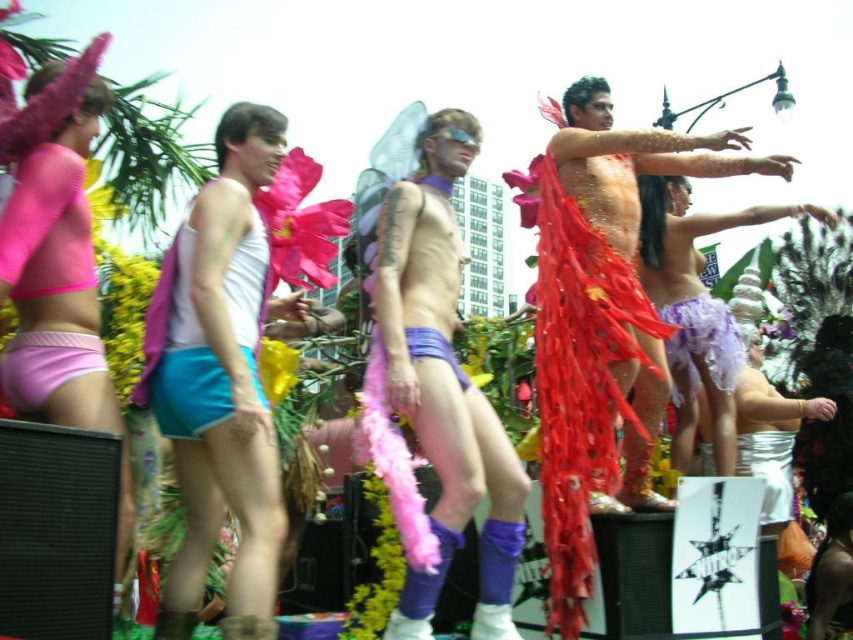
Is pink mesh top at left positioned in front of pink fabric underwear at lower left?

Yes, it is.

Who is shorter, pink mesh top at left or pink fabric underwear at lower left?

pink fabric underwear at lower left is shorter.

In order to click on pink mesh top at left in this screenshot , I will do `click(45, 227)`.

Which is above, pink matte shorts at left or pink fabric underwear at lower left?

pink matte shorts at left

Looking at this image, is pink matte shorts at left to the left of pink fabric underwear at lower left from the viewer's perspective?

Indeed, pink matte shorts at left is positioned on the left side of pink fabric underwear at lower left.

Describe the element at coordinates (53, 248) in the screenshot. This screenshot has height=640, width=853. I see `pink matte shorts at left` at that location.

The image size is (853, 640). In order to click on pink matte shorts at left in this screenshot , I will do `click(53, 248)`.

Which of these two, purple matte shorts at center or teal fabric shorts at center, stands taller?

Result: purple matte shorts at center

Is purple matte shorts at center thinner than teal fabric shorts at center?

No.

Describe the element at coordinates (444, 384) in the screenshot. I see `purple matte shorts at center` at that location.

Identify the location of purple matte shorts at center. (444, 384).